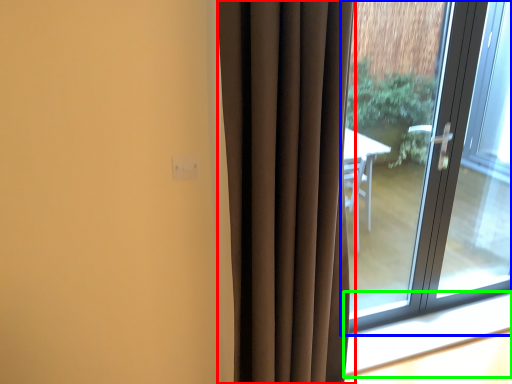
Question: Estimate the real-world distances between objects in this image. Which object is closer to curtain (highlighted by a red box), window (highlighted by a blue box) or window sill (highlighted by a green box)?

Choices:
 (A) window
 (B) window sill

Answer: (A)